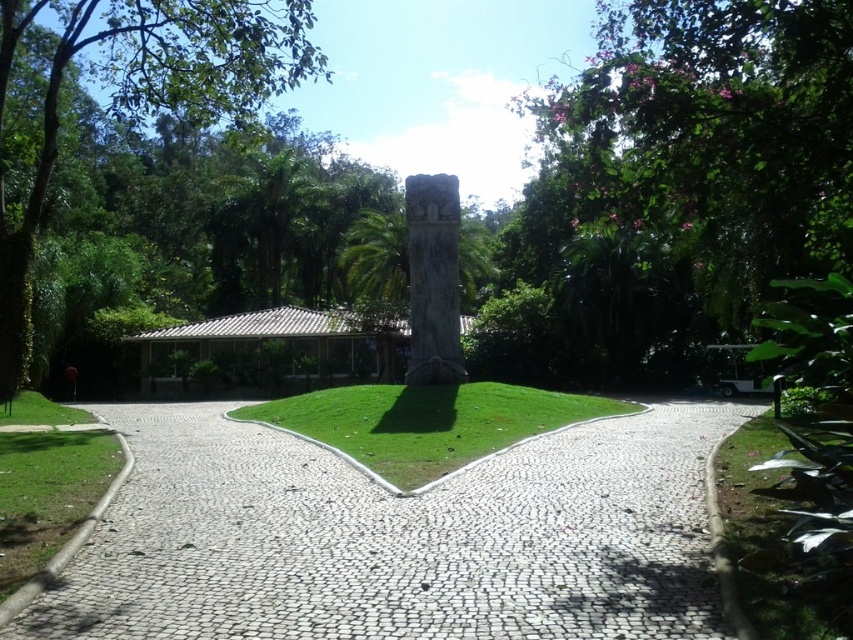
You are a gardener who wants to mow the lawn. You notice two patches of green grass at center and green grass at lower left. Which area should you mow first if you want to cut the taller grass first?

The green grass at center should be mowed first because it is taller than the green grass at lower left.